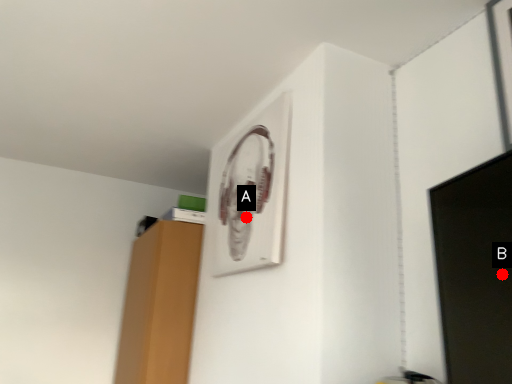
Question: Two points are circled on the image, labeled by A and B beside each circle. Which point is farther from the camera taking this photo?

Choices:
 (A) A is further
 (B) B is further

Answer: (A)